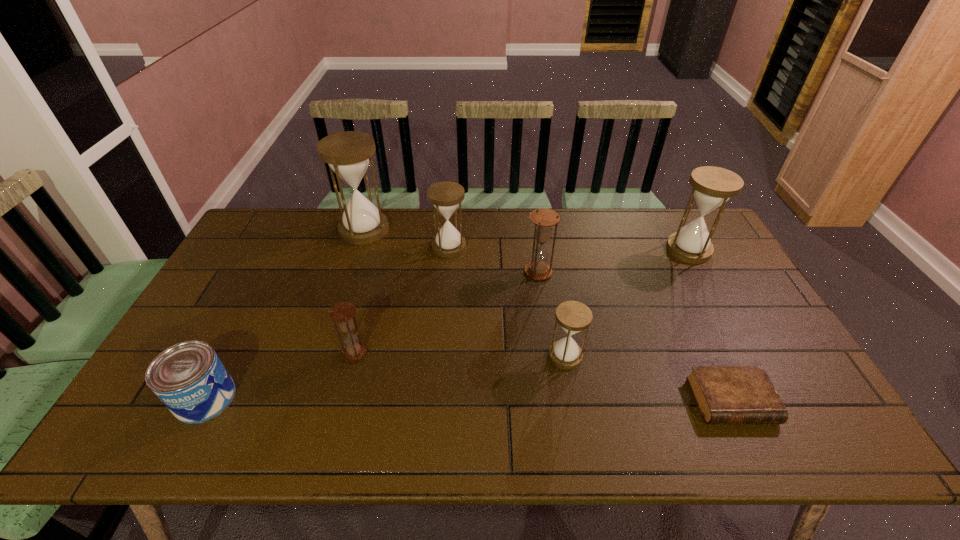
Locate an element on the screen. Image resolution: width=960 pixels, height=540 pixels. blank space at the near edge is located at coordinates (529, 431).

The height and width of the screenshot is (540, 960). I want to click on vacant region at the right edge of the desktop, so click(x=725, y=261).

This screenshot has height=540, width=960. Find the location of `vacant space at the far left corner of the desktop`. vacant space at the far left corner of the desktop is located at coordinates (301, 215).

This screenshot has height=540, width=960. Find the location of `free space between the leftmost white hourglass and the diary`. free space between the leftmost white hourglass and the diary is located at coordinates (548, 315).

The width and height of the screenshot is (960, 540). Find the location of `free space between the leftmost object and the smallest white hourglass`. free space between the leftmost object and the smallest white hourglass is located at coordinates (385, 377).

Locate an element on the screen. empty space between the second tallest object and the fifth object from right to left is located at coordinates (569, 248).

The image size is (960, 540). Identify the location of free space that is in between the second white hourglass from right to left and the rightmost hourglass. (627, 303).

Where is `free space between the second tallest hourglass and the tallest hourglass`? free space between the second tallest hourglass and the tallest hourglass is located at coordinates (526, 240).

Where is `free space that is in between the seventh tallest object and the third smallest white hourglass`? free space that is in between the seventh tallest object and the third smallest white hourglass is located at coordinates (447, 324).

Image resolution: width=960 pixels, height=540 pixels. Find the location of `free space between the rightmost white hourglass and the bigger brown hourglass`. free space between the rightmost white hourglass and the bigger brown hourglass is located at coordinates pyautogui.click(x=613, y=261).